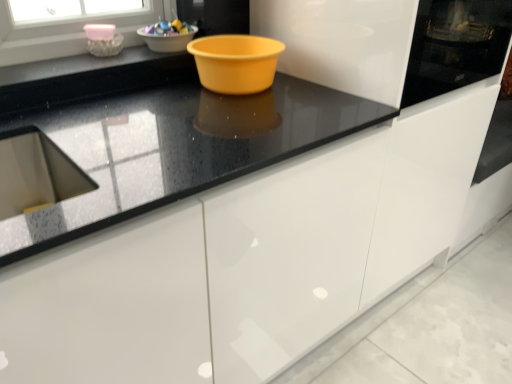
Question: Considering their positions, is black glossy countertop at center located in front of or behind black glossy countertop at upper center?

Choices:
 (A) front
 (B) behind

Answer: (A)

Question: Do you think black glossy countertop at center is within black glossy countertop at upper center, or outside of it?

Choices:
 (A) inside
 (B) outside

Answer: (B)

Question: Which is farther from the matte plastic bowl at upper center, acting as the second basin starting from the left?

Choices:
 (A) pink glass bowl at upper left, the 2th basin when ordered from right to left
 (B) black glossy countertop at upper center
 (C) black glossy countertop at center
 (D) shiny plastic bowl at upper center

Answer: (C)

Question: Which object is positioned farthest from the shiny plastic bowl at upper center?

Choices:
 (A) pink glass bowl at upper left, the 2th basin when ordered from right to left
 (B) black glossy countertop at upper center
 (C) matte plastic bowl at upper center, which appears as the 1th basin when viewed from the right
 (D) black glossy countertop at center

Answer: (D)